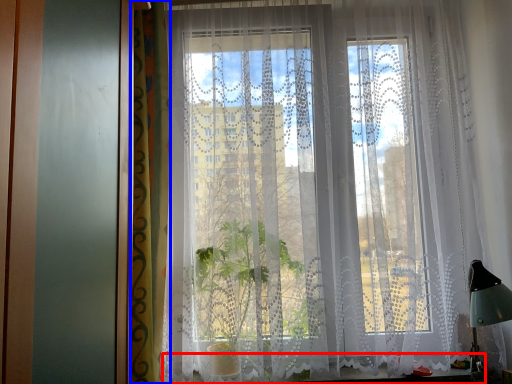
Question: Which object appears farthest to the camera in this image, window sill (highlighted by a red box) or curtain (highlighted by a blue box)?

Choices:
 (A) window sill
 (B) curtain

Answer: (A)